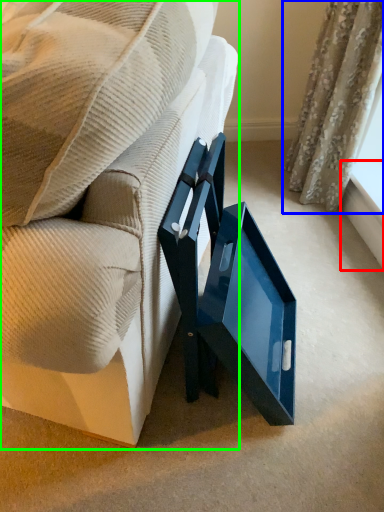
Question: Estimate the real-world distances between objects in this image. Which object is closer to window sill (highlighted by a red box), curtain (highlighted by a blue box) or furniture (highlighted by a green box)?

Choices:
 (A) curtain
 (B) furniture

Answer: (A)